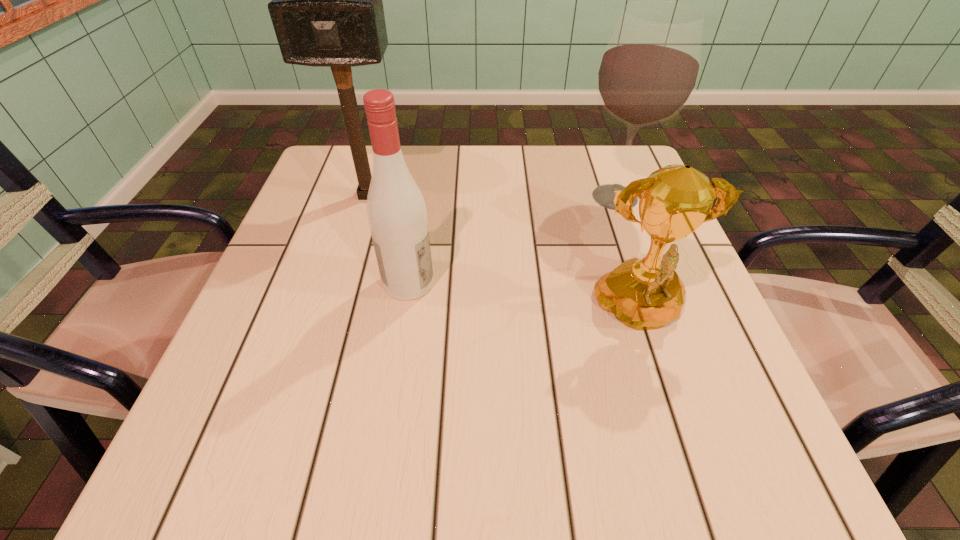
The image size is (960, 540). What are the coordinates of `object situated at the left edge` in the screenshot? It's located at pos(327,11).

This screenshot has width=960, height=540. I want to click on alcohol situated at the right edge, so click(x=649, y=70).

This screenshot has height=540, width=960. I want to click on award at the right edge, so click(644, 294).

At what (x,y) coordinates should I click in order to perform the action: click on object that is positioned at the far left corner. Please return your answer as a coordinate pair (x, y). The image size is (960, 540). Looking at the image, I should click on (327, 11).

Where is `object at the far right corner`? This screenshot has width=960, height=540. object at the far right corner is located at coordinates (649, 70).

Where is `vacant region at the far edge of the desktop`? vacant region at the far edge of the desktop is located at coordinates (538, 189).

Image resolution: width=960 pixels, height=540 pixels. I want to click on vacant space at the near edge of the desktop, so click(503, 480).

The image size is (960, 540). What are the coordinates of `vacant area at the left edge of the desktop` in the screenshot? It's located at (246, 337).

You are a GUI agent. You are given a task and a screenshot of the screen. Output one action in this format:
    pyautogui.click(x=<x>, y=<y>)
    Task: Click on the vacant space at the right edge of the desktop
    
    Given the screenshot: What is the action you would take?
    pyautogui.click(x=685, y=282)

Find the location of `free space at the far left corner`. free space at the far left corner is located at coordinates (348, 166).